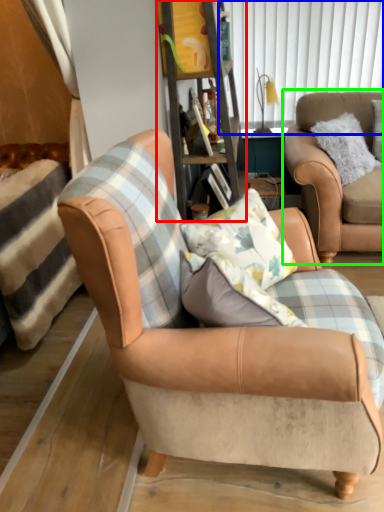
Question: Based on their relative distances, which object is farther from bookshelf (highlighted by a red box)? Choose from window screen (highlighted by a blue box) and chair (highlighted by a green box).

Choices:
 (A) window screen
 (B) chair

Answer: (A)